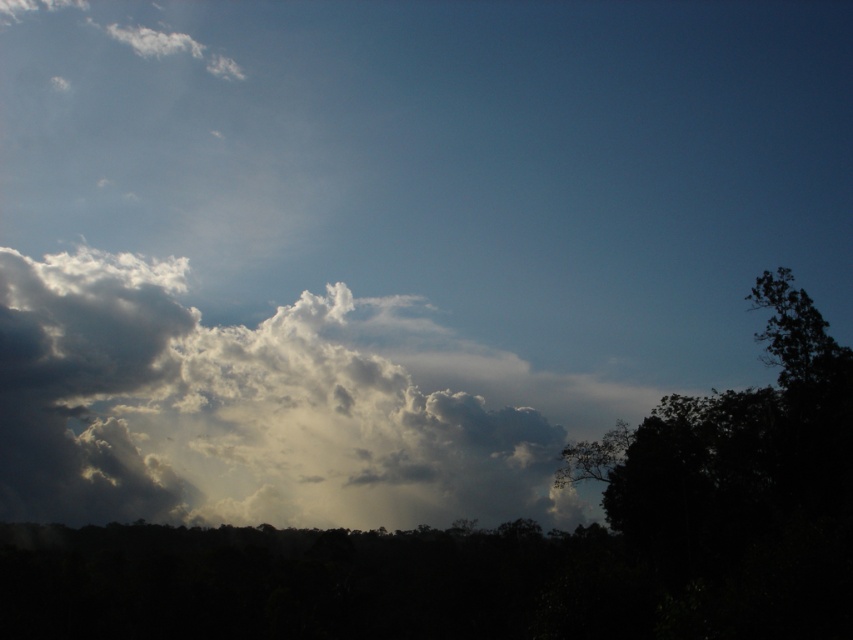
Question: Which point appears closest to the camera in this image?

Choices:
 (A) (297, 472)
 (B) (747, 545)

Answer: (B)

Question: Is white fluffy cloud at upper left further to camera compared to dark green leafy tree at right?

Choices:
 (A) yes
 (B) no

Answer: (A)

Question: Can you confirm if white fluffy cloud at upper left is smaller than dark green leafy tree at right?

Choices:
 (A) yes
 (B) no

Answer: (B)

Question: Can you confirm if white fluffy cloud at upper left is positioned below dark green leafy tree at right?

Choices:
 (A) no
 (B) yes

Answer: (B)

Question: Among these objects, which one is farthest from the camera?

Choices:
 (A) dark green leafy tree at right
 (B) white fluffy cloud at upper left

Answer: (B)